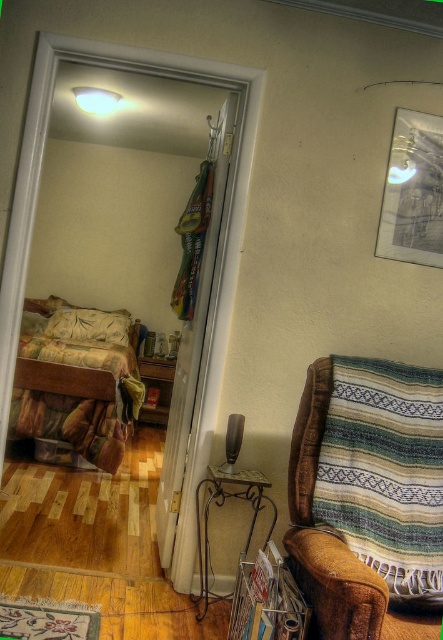
You are sitting in the brown plush armchair at right and want to look at the metallic silver picture frame at upper right. Is the frame above or below your current position?

The metallic silver picture frame at upper right is above the brown plush armchair at right because the brown plush armchair at right is below the metallic silver picture frame at upper right.